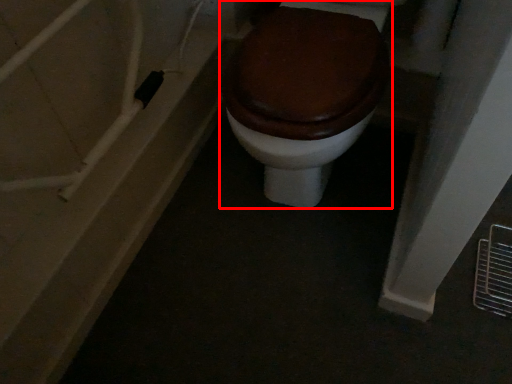
Question: Considering the relative positions of toilet (annotated by the red box) and bath in the image provided, where is toilet (annotated by the red box) located with respect to the staircase?

Choices:
 (A) left
 (B) right

Answer: (B)